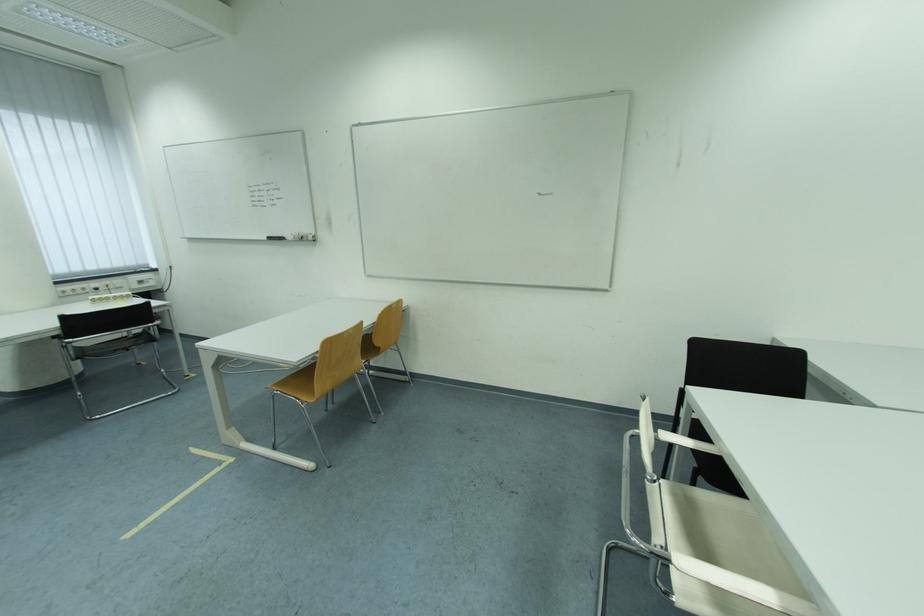
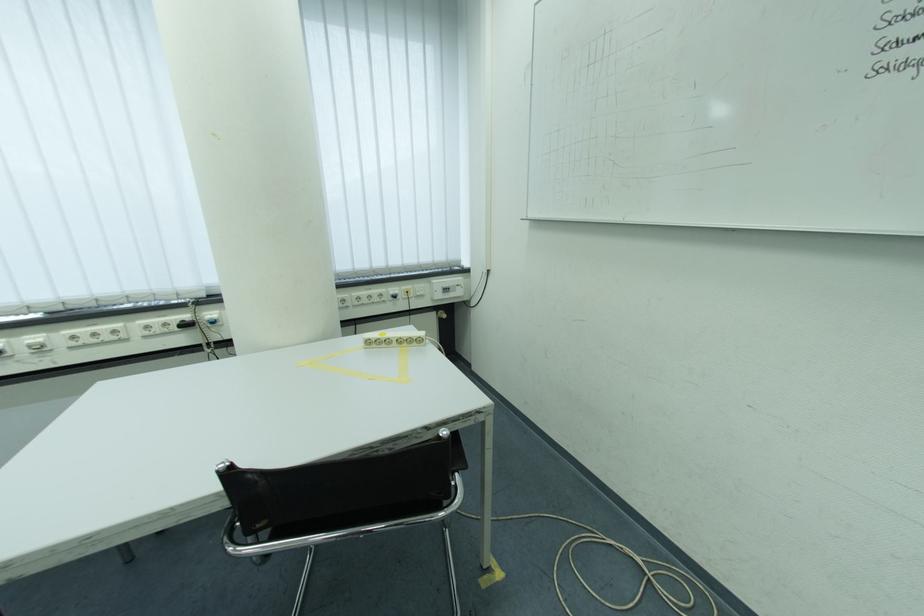
In the second image, find the point that corresponds to pixel 103 286 in the first image.

(402, 291)